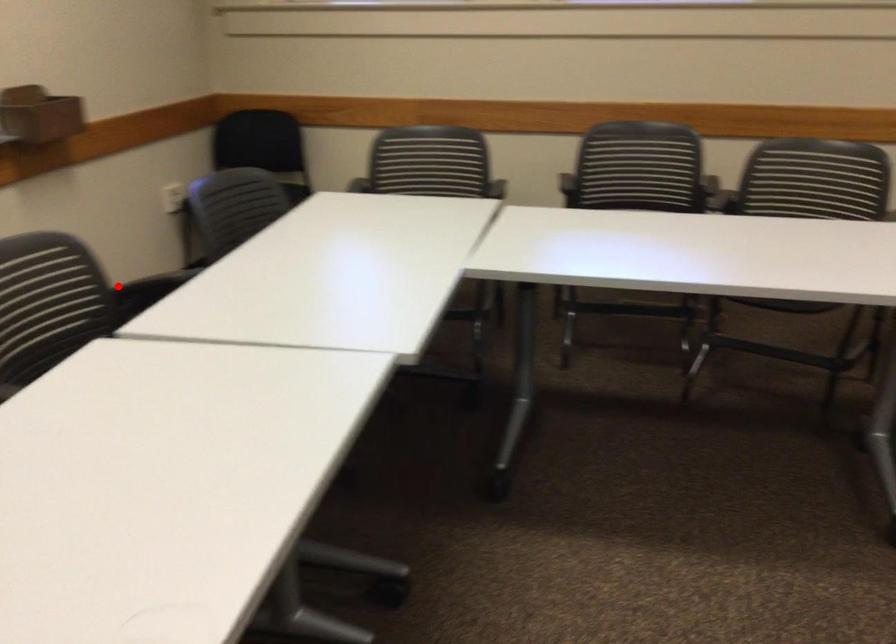
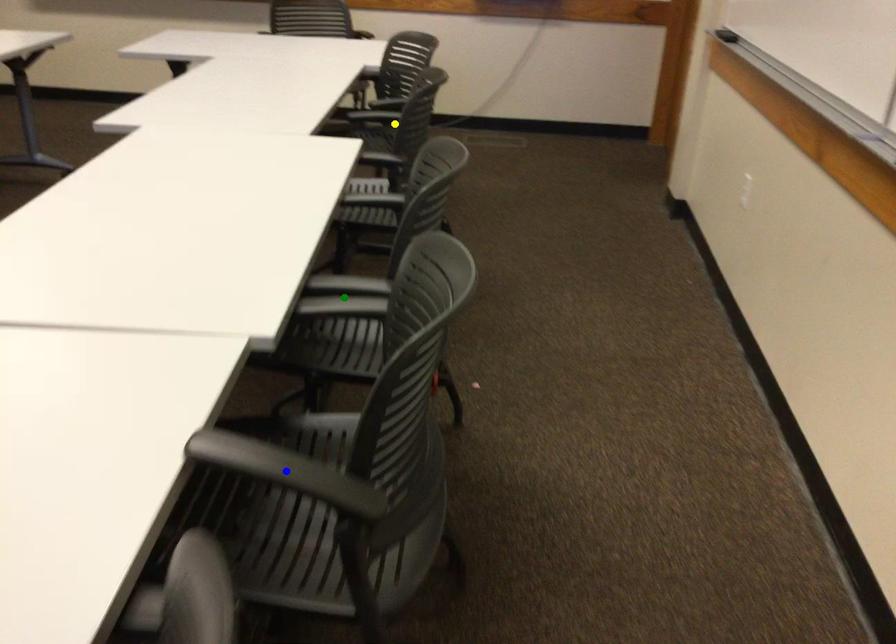
Question: I am providing you with two images of the same scene from different viewpoints. A red point is marked on the first image. You are given multiple points on the second image. Which point in image 2 is actually the same real-world point as the red point in image 1?

Choices:
 (A) green point
 (B) yellow point
 (C) blue point

Answer: (C)